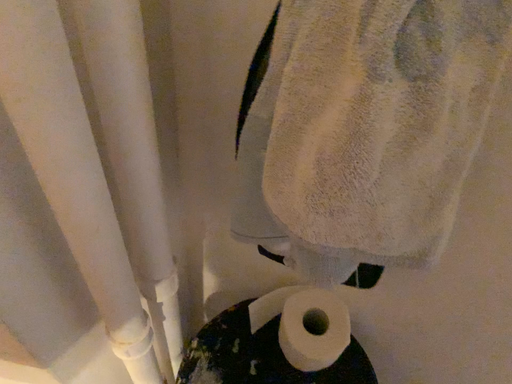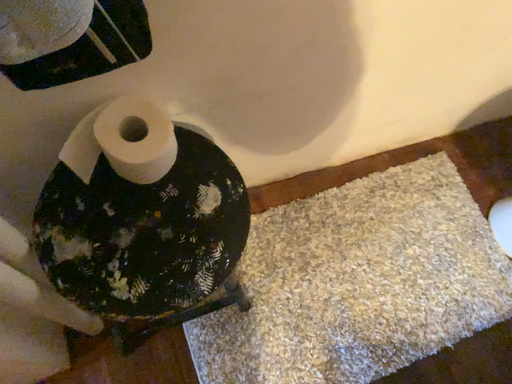
Question: How did the camera likely rotate when shooting the video?

Choices:
 (A) rotated downward
 (B) rotated upward

Answer: (A)